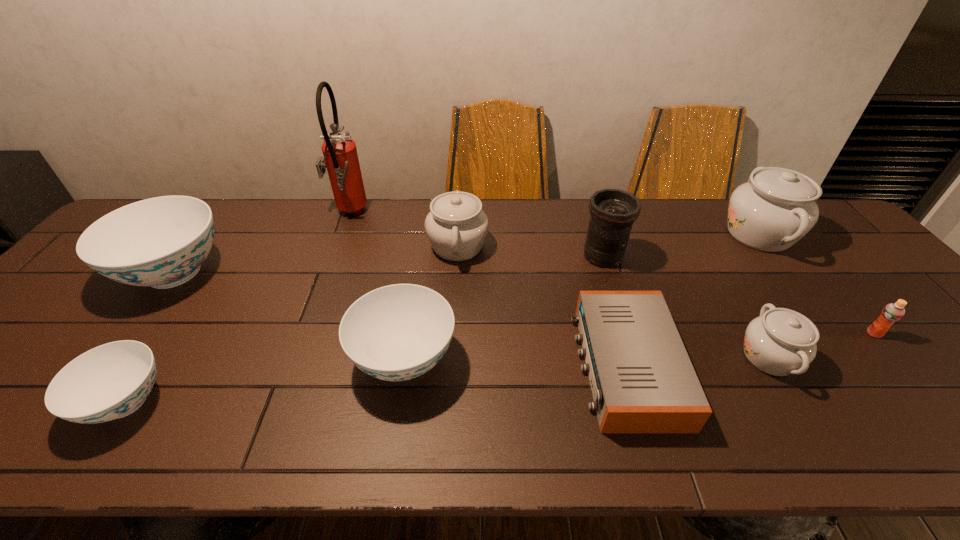
Find the location of a particular element. This screenshot has height=540, width=960. chinaware at the right edge is located at coordinates (777, 207).

I want to click on orange juice that is positioned at the right edge, so click(892, 312).

This screenshot has height=540, width=960. Identify the location of object at the far left corner. (x=161, y=242).

Find the location of a particular element. object that is positioned at the far right corner is located at coordinates (777, 207).

Image resolution: width=960 pixels, height=540 pixels. In order to click on vacant area at the far edge in this screenshot , I will do `click(323, 232)`.

Identify the location of free space at the near edge of the desktop. The width and height of the screenshot is (960, 540). (74, 434).

Image resolution: width=960 pixels, height=540 pixels. In the image, there is a desktop. Identify the location of free space at the left edge. (36, 318).

Identify the location of vacant region at the right edge of the desktop. Image resolution: width=960 pixels, height=540 pixels. (841, 279).

The image size is (960, 540). I want to click on free space at the far right corner of the desktop, so click(812, 230).

Identify the location of free area in between the shortest chinaware and the smallest white chinaware. This screenshot has width=960, height=540. (447, 380).